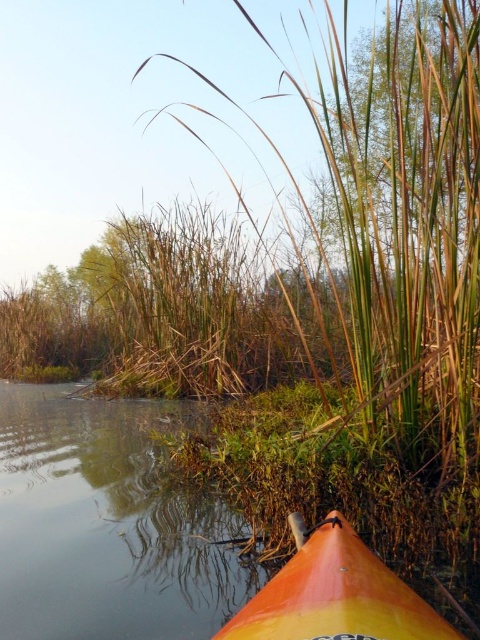
Is smooth orange kayak at lower right shorter than orange/yellow plastic canoe at lower center?

No, smooth orange kayak at lower right is not shorter than orange/yellow plastic canoe at lower center.

Where is `smooth orange kayak at lower right`? The image size is (480, 640). smooth orange kayak at lower right is located at coordinates (107, 524).